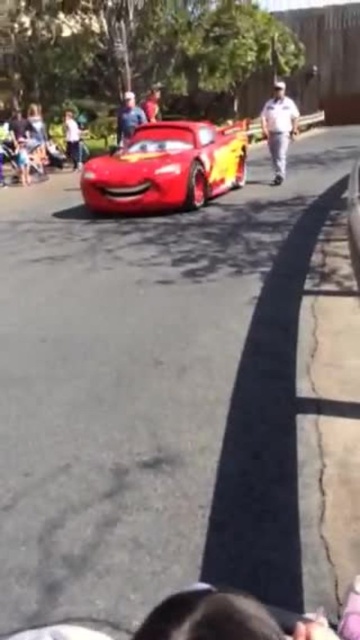
Who is positioned more to the right, blue denim shirt at center or matte red car at center?

blue denim shirt at center

Between point (125, 125) and point (70, 141), which one is positioned in front?

Point (125, 125)

Where is `blue denim shirt at center`? The height and width of the screenshot is (640, 360). blue denim shirt at center is located at coordinates (128, 116).

Between point (72, 131) and point (158, 113), which one is positioned in front?

Point (72, 131)

Is matte red car at center positioned before matte red shirt at upper center?

No, it is not.

What do you see at coordinates (73, 140) in the screenshot? This screenshot has width=360, height=640. I see `matte red car at center` at bounding box center [73, 140].

The image size is (360, 640). What are the coordinates of `matte red car at center` in the screenshot? It's located at (73, 140).

Does shiny red car at center appear on the right side of matte red car at center?

Indeed, shiny red car at center is positioned on the right side of matte red car at center.

Which of these two, shiny red car at center or matte red car at center, stands taller?

shiny red car at center is taller.

Who is more distant from viewer, (196,161) or (70,156)?

The point (70,156) is more distant.

What are the coordinates of `shiny red car at center` in the screenshot? It's located at (167, 168).